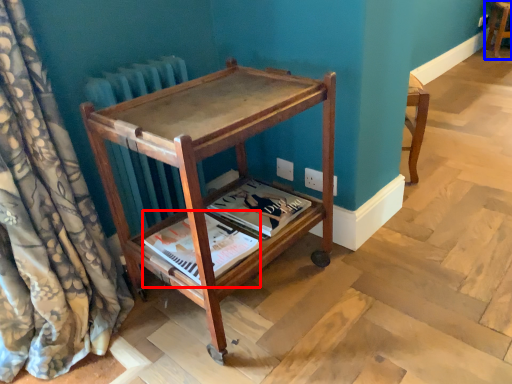
Question: Among these objects, which one is farthest to the camera, magazine (highlighted by a red box) or furniture (highlighted by a blue box)?

Choices:
 (A) magazine
 (B) furniture

Answer: (B)